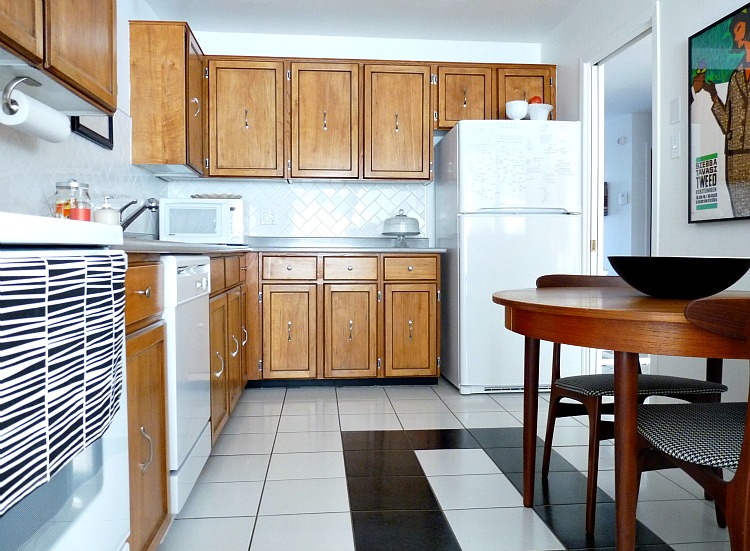
Locate an element on the screen. This screenshot has height=551, width=750. dish washer is located at coordinates tap(192, 300).